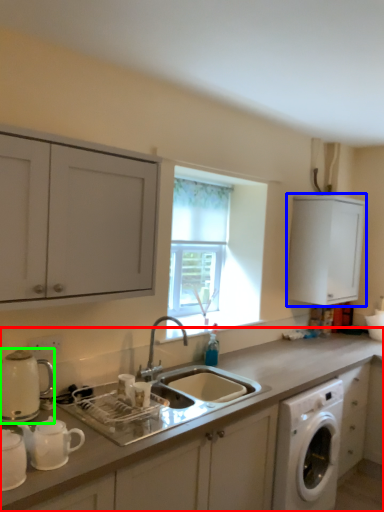
Question: Estimate the real-world distances between objects in this image. Which object is closer to countertop (highlighted by a red box), cabinetry (highlighted by a blue box) or appliance (highlighted by a green box)?

Choices:
 (A) cabinetry
 (B) appliance

Answer: (B)